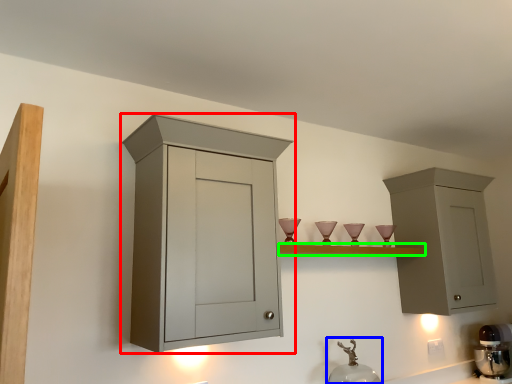
Question: Based on their relative distances, which object is nearer to cabinetry (highlighted by a red box)? Choose from faucet (highlighted by a blue box) and shelf (highlighted by a green box).

Choices:
 (A) faucet
 (B) shelf

Answer: (B)